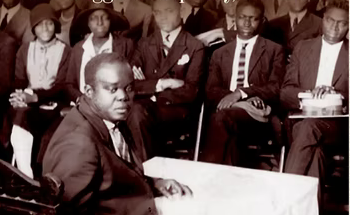
Locate an element on the screen. Image resolution: width=350 pixels, height=215 pixels. empty white table is located at coordinates (223, 187).